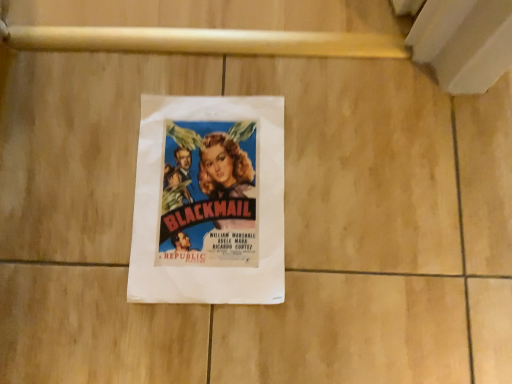
What do you see at coordinates (209, 201) in the screenshot? The image size is (512, 384). I see `matte paper poster at center` at bounding box center [209, 201].

The width and height of the screenshot is (512, 384). What are the coordinates of `matte paper poster at center` in the screenshot? It's located at (209, 201).

Find the location of a particular element. matte paper poster at center is located at coordinates (209, 201).